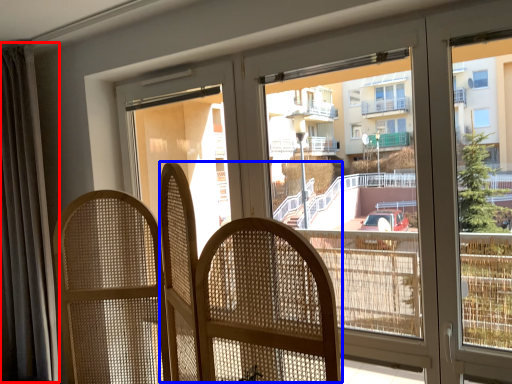
Question: Which point is further to the camera, curtain (highlighted by a red box) or rocking chair (highlighted by a blue box)?

Choices:
 (A) curtain
 (B) rocking chair

Answer: (A)